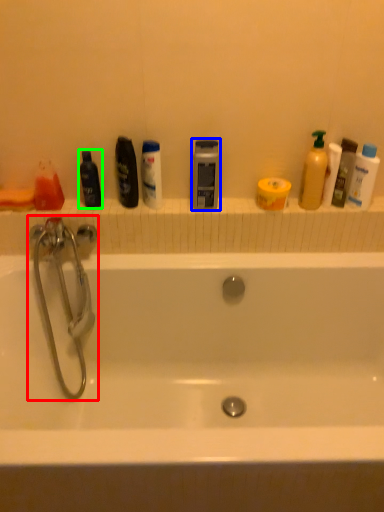
Question: Which is nearer to the tap (highlighted by a red box)? mouthwash (highlighted by a blue box) or mouthwash (highlighted by a green box).

Choices:
 (A) mouthwash
 (B) mouthwash

Answer: (B)